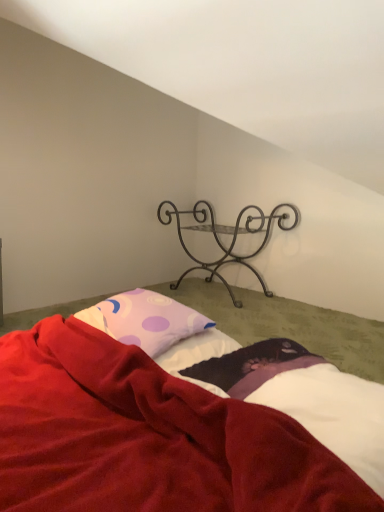
The width and height of the screenshot is (384, 512). What do you see at coordinates (228, 234) in the screenshot? I see `metallic wrought iron shelf at upper center` at bounding box center [228, 234].

You are a GUI agent. You are given a task and a screenshot of the screen. Output one action in this format:
    pyautogui.click(x=<x>, y=<y>)
    Task: Click on the velvet red blanket at lower center
    
    Given the screenshot: What is the action you would take?
    pyautogui.click(x=147, y=437)

Locate an element on the screen. sheet below the metallic wrought iron shelf at upper center (from the image's perspective) is located at coordinates (296, 394).

From a real-world perspective, is white soft sheet at lower right over metallic wrought iron shelf at upper center?

Incorrect, from a real-world perspective, white soft sheet at lower right is lower than metallic wrought iron shelf at upper center.

Is white soft sheet at lower right not close to metallic wrought iron shelf at upper center?

Yes, white soft sheet at lower right and metallic wrought iron shelf at upper center are located far from each other.

Is white soft sheet at lower right outside of metallic wrought iron shelf at upper center?

Indeed, white soft sheet at lower right is completely outside metallic wrought iron shelf at upper center.

Does point (309, 509) come farther from viewer compared to point (287, 384)?

No, (309, 509) is closer to viewer.

The image size is (384, 512). In order to click on sheet behind the velvet red blanket at lower center in this screenshot , I will do `click(296, 394)`.

From a real-world perspective, is velvet red blanket at lower center under white soft sheet at lower right?

Yes, from a real-world perspective, velvet red blanket at lower center is beneath white soft sheet at lower right.

From the image's perspective, which one is positioned higher, velvet red blanket at lower center or white soft sheet at lower right?

white soft sheet at lower right appears higher in the image.

Can you see purple dotted pillow at center touching metallic wrought iron shelf at upper center?

No, purple dotted pillow at center is not in contact with metallic wrought iron shelf at upper center.

In the scene shown: Does purple dotted pillow at center have a larger size compared to metallic wrought iron shelf at upper center?

Actually, purple dotted pillow at center might be smaller than metallic wrought iron shelf at upper center.

From a real-world perspective, is purple dotted pillow at center over metallic wrought iron shelf at upper center?

Yes, from a real-world perspective, purple dotted pillow at center is over metallic wrought iron shelf at upper center

Is point (122, 339) positioned in front of point (245, 228)?

Yes, it is.

Is purple dotted pillow at center beside velvet red blanket at lower center?

No.

From a real-world perspective, which object stands above the other?

From a 3D spatial view, purple dotted pillow at center is above.

Is purple dotted pillow at center oriented away from velvet red blanket at lower center?

That's right, purple dotted pillow at center is facing away from velvet red blanket at lower center.

Measure the distance between purple dotted pillow at center and velvet red blanket at lower center.

purple dotted pillow at center is 9.44 inches away from velvet red blanket at lower center.

Would you say white soft sheet at lower right is to the left or to the right of velvet red blanket at lower center in the picture?

From the image, it's evident that white soft sheet at lower right is to the right of velvet red blanket at lower center.

Is point (321, 388) more distant than point (174, 453)?

Yes, it is.

In the image, is white soft sheet at lower right positioned in front of or behind velvet red blanket at lower center?

white soft sheet at lower right is behind velvet red blanket at lower center.

From a real-world perspective, is white soft sheet at lower right under velvet red blanket at lower center?

No, from a real-world perspective, white soft sheet at lower right is not under velvet red blanket at lower center.

Does purple dotted pillow at center have a lesser height compared to white soft sheet at lower right?

In fact, purple dotted pillow at center may be taller than white soft sheet at lower right.

Considering their positions, is purple dotted pillow at center located in front of or behind white soft sheet at lower right?

purple dotted pillow at center is positioned farther from the viewer than white soft sheet at lower right.

Consider the image. Is purple dotted pillow at center touching white soft sheet at lower right?

There is a gap between purple dotted pillow at center and white soft sheet at lower right.

Consider the image. Is metallic wrought iron shelf at upper center further to camera compared to velvet red blanket at lower center?

Yes, metallic wrought iron shelf at upper center is further from the camera.

Is metallic wrought iron shelf at upper center directly adjacent to velvet red blanket at lower center?

metallic wrought iron shelf at upper center and velvet red blanket at lower center are not in contact.

In terms of size, does metallic wrought iron shelf at upper center appear bigger or smaller than velvet red blanket at lower center?

Clearly, metallic wrought iron shelf at upper center is smaller in size than velvet red blanket at lower center.

You are a GUI agent. You are given a task and a screenshot of the screen. Output one action in this format:
    pyautogui.click(x=<x>, y=<y>)
    Task: Click on the sheet in front of the metallic wrought iron shelf at upper center
    The image size is (384, 512).
    Given the screenshot: What is the action you would take?
    pyautogui.click(x=296, y=394)

Where is `bed that is on the left side of white soft sheet at lower right`? The width and height of the screenshot is (384, 512). bed that is on the left side of white soft sheet at lower right is located at coordinates (147, 437).

Looking at the image, which one is located further to white soft sheet at lower right, metallic wrought iron shelf at upper center or purple dotted pillow at center?

The object further to white soft sheet at lower right is metallic wrought iron shelf at upper center.

From the image, which object appears to be nearer to velvet red blanket at lower center, metallic wrought iron shelf at upper center or purple dotted pillow at center?

Based on the image, purple dotted pillow at center appears to be nearer to velvet red blanket at lower center.

Estimate the real-world distances between objects in this image. Which object is closer to metallic wrought iron shelf at upper center, purple dotted pillow at center or white soft sheet at lower right?

purple dotted pillow at center lies closer to metallic wrought iron shelf at upper center than the other object.

Considering their positions, is white soft sheet at lower right positioned further to metallic wrought iron shelf at upper center than velvet red blanket at lower center?

velvet red blanket at lower center is positioned further to the anchor metallic wrought iron shelf at upper center.

From the image, which object appears to be nearer to purple dotted pillow at center, velvet red blanket at lower center or white soft sheet at lower right?

The object closer to purple dotted pillow at center is velvet red blanket at lower center.

Based on the photo, which object lies further to the anchor point metallic wrought iron shelf at upper center, velvet red blanket at lower center or white soft sheet at lower right?

velvet red blanket at lower center is positioned further to the anchor metallic wrought iron shelf at upper center.

Considering their positions, is purple dotted pillow at center positioned closer to velvet red blanket at lower center than white soft sheet at lower right?

Among the two, white soft sheet at lower right is located nearer to velvet red blanket at lower center.

From the image, which object appears to be nearer to white soft sheet at lower right, purple dotted pillow at center or velvet red blanket at lower center?

The object closer to white soft sheet at lower right is velvet red blanket at lower center.

Where is `pillow located between velvet red blanket at lower center and metallic wrought iron shelf at upper center in the depth direction`? The height and width of the screenshot is (512, 384). pillow located between velvet red blanket at lower center and metallic wrought iron shelf at upper center in the depth direction is located at coordinates 145,320.

This screenshot has width=384, height=512. Identify the location of sheet located between velvet red blanket at lower center and metallic wrought iron shelf at upper center in the depth direction. (296, 394).

This screenshot has width=384, height=512. Find the location of `sheet between velvet red blanket at lower center and purple dotted pillow at center from front to back`. sheet between velvet red blanket at lower center and purple dotted pillow at center from front to back is located at coordinates (296, 394).

The image size is (384, 512). I want to click on pillow between white soft sheet at lower right and metallic wrought iron shelf at upper center along the z-axis, so 145,320.